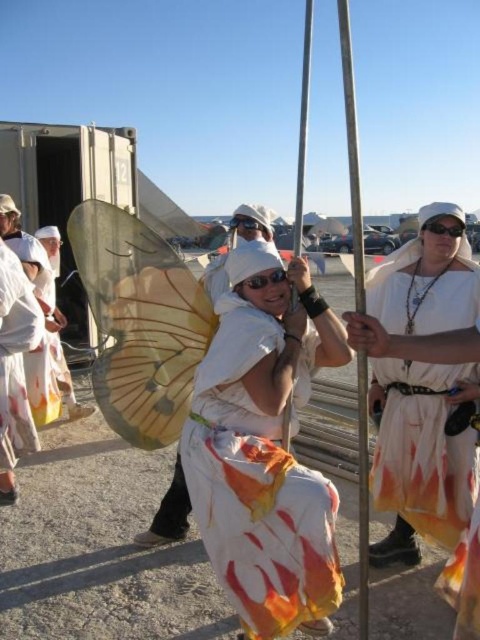
Question: Which is nearer to the white paper fan at center?

Choices:
 (A) white cotton dress at center
 (B) white fabric wings at center

Answer: (A)

Question: Can you confirm if white cotton dress at center is wider than white fabric wings at center?

Choices:
 (A) yes
 (B) no

Answer: (A)

Question: Which of these objects is positioned closest to the white fabric wings at center?

Choices:
 (A) white cotton dress at center
 (B) metallic pole at center
 (C) white paper fan at center

Answer: (C)

Question: Can you confirm if white paper fan at center is positioned below white fabric wings at center?

Choices:
 (A) no
 (B) yes

Answer: (A)

Question: Among these objects, which one is farthest from the camera?

Choices:
 (A) white cotton dress at center
 (B) white paper fan at center

Answer: (A)

Question: Does white paper fan at center appear on the right side of white fabric wings at center?

Choices:
 (A) yes
 (B) no

Answer: (A)